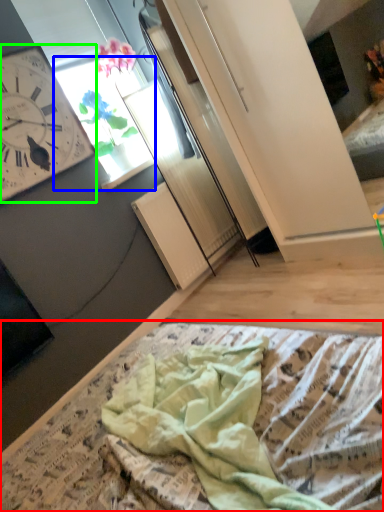
Question: Which is nearer to the blanket (highlighted by a red box)? window (highlighted by a blue box) or wall clock (highlighted by a green box).

Choices:
 (A) window
 (B) wall clock

Answer: (B)